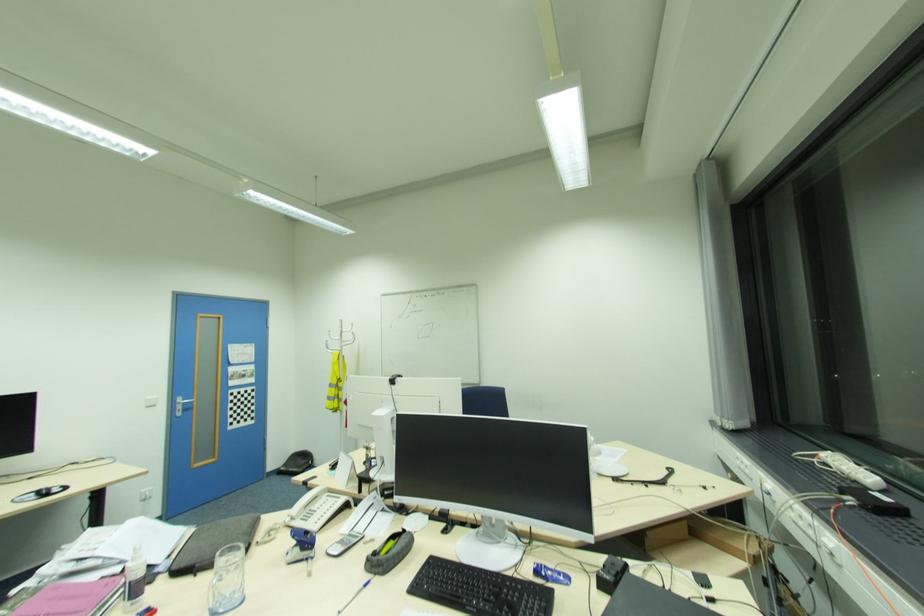
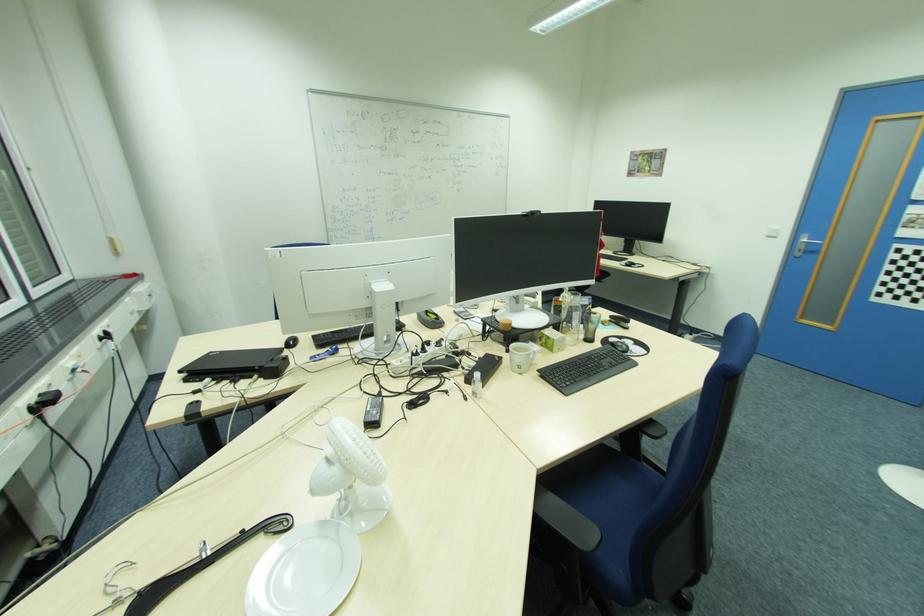
In the second image, find the point that corresponds to point (181, 410) in the first image.

(804, 251)